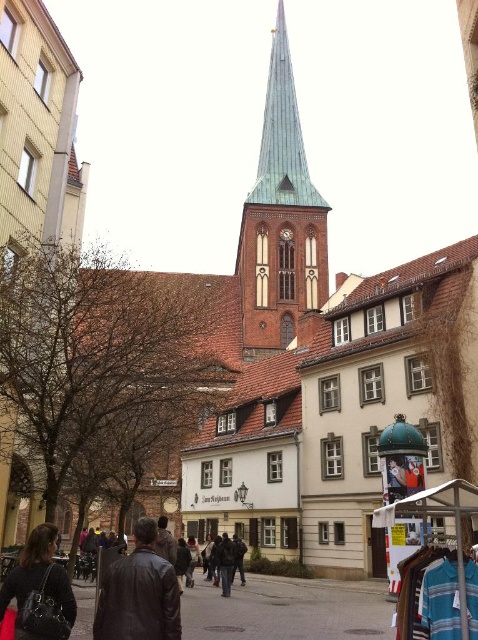
You are a tourist standing on the street and want to take a photo of the green copper spire at center and the leather jacket at center. Which object should you zoom in more on to capture both in clear detail?

You should zoom in more on the leather jacket at center because the green copper spire at center is larger in size, so zooming in on the smaller object ensures both are captured clearly.

You are a tourist standing on the street looking at the green copper spire at center and the matte black jacket at lower left. Which object is closer to you?

The matte black jacket at lower left is behind the green copper spire at center, so the green copper spire at center is closer to you.

You are a tourist standing on the street looking at the green copper spire at center and the leather jacket at center. Which object appears taller in the image?

The green copper spire at center appears much taller than the leather jacket at center in the image.